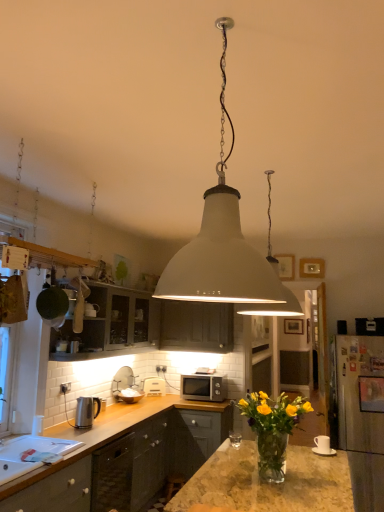
Where is `white glossy sink at lower left`? white glossy sink at lower left is located at coordinates (30, 448).

In order to face white plastic electric outlet at center, should I rotate leftwards or rightwards?

You should rotate left by 4.130 degrees.

What is the approximate width of white plastic electric outlet at center?

It is 0.76 inches.

What do you see at coordinates (274, 307) in the screenshot?
I see `white matte pendant light at center, marked as the 2th lamp in a left-to-right arrangement` at bounding box center [274, 307].

What do you see at coordinates (272, 429) in the screenshot? I see `translucent glass vase at center` at bounding box center [272, 429].

Find the location of a particular element. Image resolution: width=384 pixels, height=512 pixels. polished stainless steel kettle at lower left, the 2th appliance positioned from the back is located at coordinates point(86,411).

What do you see at coordinates (147, 324) in the screenshot? I see `matte dark wood cabinets at upper left, which is counted as the second cabinetry, starting from the right` at bounding box center [147, 324].

What is the approximate height of dark wood cabinet at center, which is the first cabinetry from right to left?

The height of dark wood cabinet at center, which is the first cabinetry from right to left, is 63.68 centimeters.

Where is `white glossy sink at lower left`? This screenshot has width=384, height=512. white glossy sink at lower left is located at coordinates pos(30,448).

Is satin silver microwave at center aimed at white matte pendant light at center, the first lamp in the back-to-front sequence?

No, satin silver microwave at center is not turned towards white matte pendant light at center, the first lamp in the back-to-front sequence.

Between satin silver microwave at center and white matte pendant light at center, the first lamp in the back-to-front sequence, which one appears on the left side from the viewer's perspective?

Positioned to the left is satin silver microwave at center.

In the image, is satin silver microwave at center positioned in front of or behind white matte pendant light at center, the first lamp in the back-to-front sequence?

Clearly, satin silver microwave at center is behind white matte pendant light at center, the first lamp in the back-to-front sequence.

Considering the sizes of objects satin silver microwave at center and white matte pendant light at center, the first lamp in the back-to-front sequence, in the image provided, who is thinner, satin silver microwave at center or white matte pendant light at center, the first lamp in the back-to-front sequence,?

Thinner between the two is satin silver microwave at center.

Starting from the white plastic electric outlet at center, which appliance is the 2nd one to the left? Please provide its 2D coordinates.

[(86, 411)]

Is point (157, 367) positioned before point (90, 409)?

No, (157, 367) is further to viewer.

Based on the photo, considering the sizes of objects white plastic electric outlet at center and polished stainless steel kettle at lower left, marked as the 1th appliance in a front-to-back arrangement, in the image provided, who is thinner, white plastic electric outlet at center or polished stainless steel kettle at lower left, marked as the 1th appliance in a front-to-back arrangement,?

white plastic electric outlet at center.

From a real-world perspective, which object rests below the other?

polished stainless steel kettle at lower left, marked as the 1th appliance in a front-to-back arrangement.

Where is `sink located underneath the dark wood cabinet at center, which is the first cabinetry from right to left (from a real-world perspective)`? The width and height of the screenshot is (384, 512). sink located underneath the dark wood cabinet at center, which is the first cabinetry from right to left (from a real-world perspective) is located at coordinates (30, 448).

Looking at the image, does white glossy sink at lower left seem bigger or smaller compared to dark wood cabinet at center, which is the first cabinetry from right to left?

In the image, white glossy sink at lower left appears to be smaller than dark wood cabinet at center, which is the first cabinetry from right to left.

Which object is further away from the camera taking this photo, white glossy sink at lower left or dark wood cabinet at center, the second cabinetry positioned from the left?

dark wood cabinet at center, the second cabinetry positioned from the left, is further from the camera.

From the image's perspective, relative to dark wood cabinet at center, which is the first cabinetry from right to left, is white glossy sink at lower left above or below?

Clearly, from the image's perspective, white glossy sink at lower left is below dark wood cabinet at center, which is the first cabinetry from right to left.

The image size is (384, 512). Find the location of `cabinetry that is below the matte dark wood cabinets at upper left, which appears as the first cabinetry when viewed from the left (from the image's perspective)`. cabinetry that is below the matte dark wood cabinets at upper left, which appears as the first cabinetry when viewed from the left (from the image's perspective) is located at coordinates (196, 326).

Is matte dark wood cabinets at upper left, which is counted as the second cabinetry, starting from the right, located outside dark wood cabinet at center, the second cabinetry positioned from the left?

Absolutely, matte dark wood cabinets at upper left, which is counted as the second cabinetry, starting from the right, is external to dark wood cabinet at center, the second cabinetry positioned from the left.

Considering the positions of point (219, 329) and point (252, 425), is point (219, 329) closer or farther from the camera than point (252, 425)?

Point (219, 329) is positioned farther from the camera compared to point (252, 425).

Is dark wood cabinet at center, which is the first cabinetry from right to left, not inside translucent glass vase at center?

Absolutely, dark wood cabinet at center, which is the first cabinetry from right to left, is external to translucent glass vase at center.

Which is in front, dark wood cabinet at center, which is the first cabinetry from right to left, or translucent glass vase at center?

translucent glass vase at center.

Is polished stainless steel kettle at lower left, the 2th appliance positioned from the back, oriented away from white matte pendant light at center, the first lamp positioned from the right?

No, polished stainless steel kettle at lower left, the 2th appliance positioned from the back, is not facing away from white matte pendant light at center, the first lamp positioned from the right.

This screenshot has height=512, width=384. I want to click on the 1st lamp in front of the polished stainless steel kettle at lower left, marked as the 1th appliance in a front-to-back arrangement, so click(274, 307).

Does polished stainless steel kettle at lower left, the 2th appliance positioned from the back, come behind white matte pendant light at center, the first lamp in the back-to-front sequence?

That is True.

Considering the relative positions of polished stainless steel kettle at lower left, the 2th appliance positioned from the back, and white matte pendant light at center, the first lamp positioned from the right, in the image provided, is polished stainless steel kettle at lower left, the 2th appliance positioned from the back, to the right of white matte pendant light at center, the first lamp positioned from the right, from the viewer's perspective?

No.

Which object is positioned more to the left, white plastic electric outlet at center or white glossy sink at lower left?

white glossy sink at lower left.

Which is behind, white plastic electric outlet at center or white glossy sink at lower left?

white plastic electric outlet at center is behind.

What's the angular difference between white plastic electric outlet at center and white glossy sink at lower left's facing directions?

The facing directions of white plastic electric outlet at center and white glossy sink at lower left are 89.7 degrees apart.

The height and width of the screenshot is (512, 384). What are the coordinates of `lamp on the right of satin silver microwave at center` in the screenshot? It's located at (274, 307).

From the white plastic electric outlet at center, count the 2nd appliance to the left and point to it. Please provide its 2D coordinates.

[(86, 411)]

Estimate the real-world distances between objects in this image. Which object is closer to polished stainless steel kettle at lower left, marked as the first appliance in a left-to-right arrangement, white matte pendant light at center, marked as the 2th lamp in a left-to-right arrangement, or translucent glass vase at center?

translucent glass vase at center is positioned closer to the anchor polished stainless steel kettle at lower left, marked as the first appliance in a left-to-right arrangement.

Which object lies nearer to the anchor point translucent glass vase at center, satin silver microwave at center or white glossy sink at lower left?

white glossy sink at lower left lies closer to translucent glass vase at center than the other object.

From the image, which object appears to be nearer to white matte pendant light at center, the first lamp positioned from the right, dark wood cabinet at center, the second cabinetry positioned from the left, or matte dark wood cabinets at upper left, which appears as the first cabinetry when viewed from the left?

matte dark wood cabinets at upper left, which appears as the first cabinetry when viewed from the left, lies closer to white matte pendant light at center, the first lamp positioned from the right, than the other object.

From the image, which object appears to be farther from translucent glass vase at center, white glossy sink at lower left or white matte pendant light at center, which is counted as the 1th lamp, starting from the front?

white glossy sink at lower left is positioned further to the anchor translucent glass vase at center.

Considering their positions, is polished stainless steel kettle at lower left, marked as the first appliance in a left-to-right arrangement, positioned further to white plastic electric outlet at center than translucent glass vase at center?

The object further to white plastic electric outlet at center is translucent glass vase at center.

From the image, which object appears to be farther from white matte pendant light at center, the 2th lamp viewed from the back, matte dark wood cabinets at upper left, which is counted as the second cabinetry, starting from the right, or white plastic electric outlet at center?

The object further to white matte pendant light at center, the 2th lamp viewed from the back, is white plastic electric outlet at center.

When comparing their distances from white matte microwave at center, which is counted as the 1th appliance, starting from the back, does white glossy sink at lower left or polished stainless steel kettle at lower left, the 2th appliance positioned from the back, seem further?

white glossy sink at lower left lies further to white matte microwave at center, which is counted as the 1th appliance, starting from the back, than the other object.

Based on their spatial positions, is white matte pendant light at center, the first lamp in the back-to-front sequence, or matte dark wood cabinets at upper left, which is counted as the second cabinetry, starting from the right, further from dark wood cabinet at center, which is the first cabinetry from right to left?

white matte pendant light at center, the first lamp in the back-to-front sequence, is further to dark wood cabinet at center, which is the first cabinetry from right to left.

I want to click on electric outlet between white matte microwave at center, which is counted as the second appliance, starting from the front, and satin silver microwave at center, so click(161, 369).

At what (x,y) coordinates should I click in order to perform the action: click on sink located between white matte pendant light at center, which is counted as the 1th lamp, starting from the front, and satin silver microwave at center in the depth direction. Please return your answer as a coordinate pair (x, y). Looking at the image, I should click on (30, 448).

Identify the location of microwave oven between polished stainless steel kettle at lower left, marked as the first appliance in a left-to-right arrangement, and white matte microwave at center, which is the second appliance in top-to-bottom order, in the front-back direction. (204, 387).

Find the location of a particular element. appliance positioned between white matte pendant light at center, which is the 2th lamp in front-to-back order, and satin silver microwave at center from near to far is located at coordinates (86, 411).